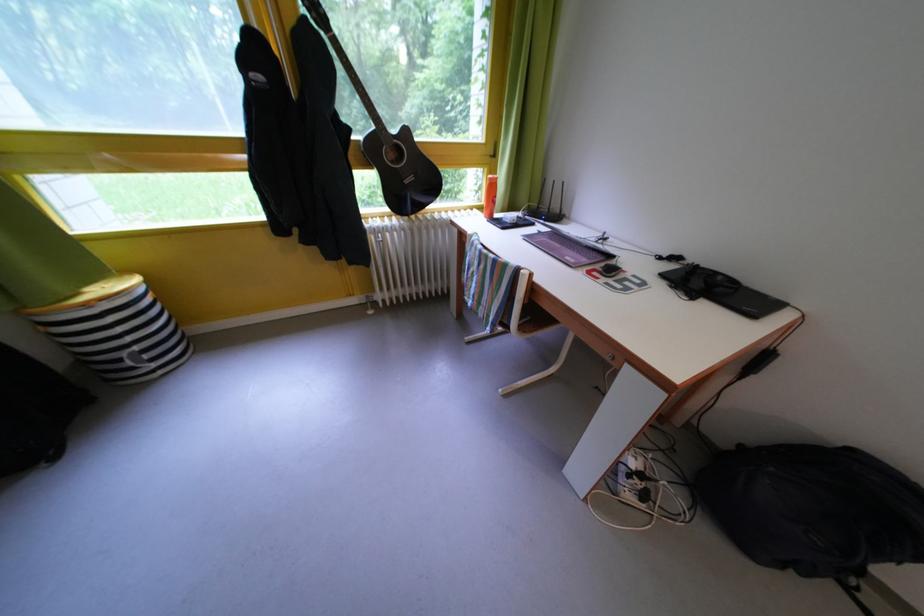
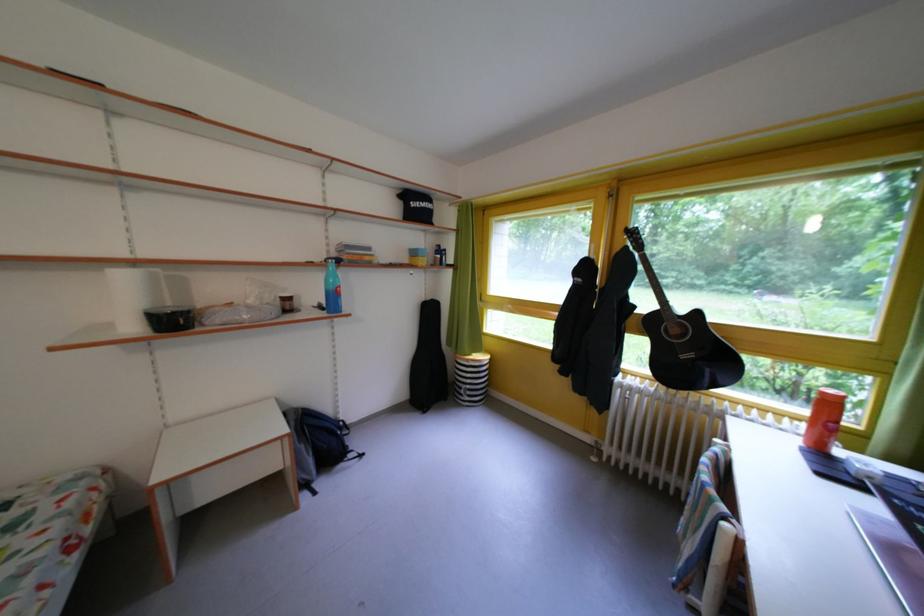
The point at (147, 354) is marked in the first image. Where is the corresponding point in the second image?

(478, 392)